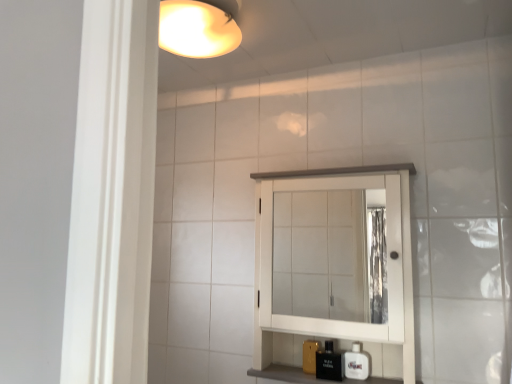
Measure the distance between point [386,177] and camera.

The distance of point [386,177] from camera is 4.38 feet.

Locate an element on the screen. black glossy bottle at lower center is located at coordinates (329, 363).

Does point (364, 376) lie behind point (321, 373)?

No, (364, 376) is in front of (321, 373).

Considering the relative sizes of white glossy soap dispenser at lower right and black glossy bottle at lower center in the image provided, is white glossy soap dispenser at lower right taller than black glossy bottle at lower center?

No.

Can you tell me how much white glossy soap dispenser at lower right and black glossy bottle at lower center differ in facing direction?

They differ by 0.0915 degrees in their facing directions.

From a real-world perspective, between white glossy soap dispenser at lower right and black glossy bottle at lower center, who is vertically lower?

In real-world perspective, black glossy bottle at lower center is lower.

Looking at this image, from their relative heights in the image, would you say black glossy bottle at lower center is taller or shorter than white glossy soap dispenser at lower right?

Considering their sizes, black glossy bottle at lower center has more height than white glossy soap dispenser at lower right.

Is point (318, 368) positioned behind point (368, 369)?

Yes, point (318, 368) is behind point (368, 369).

Is the surface of black glossy bottle at lower center in direct contact with white glossy soap dispenser at lower right?

Yes, black glossy bottle at lower center is in contact with white glossy soap dispenser at lower right.

Is white glossy soap dispenser at lower right facing away from white wood medicine cabinet at center?

Yes, white wood medicine cabinet at center is at the back of white glossy soap dispenser at lower right.

Considering the relative sizes of white glossy soap dispenser at lower right and white wood medicine cabinet at center in the image provided, is white glossy soap dispenser at lower right thinner than white wood medicine cabinet at center?

Correct, the width of white glossy soap dispenser at lower right is less than that of white wood medicine cabinet at center.

Which object is positioned more to the left, white glossy soap dispenser at lower right or white wood medicine cabinet at center?

From the viewer's perspective, white wood medicine cabinet at center appears more on the left side.

Is white glossy soap dispenser at lower right positioned in front of white wood medicine cabinet at center?

No, white glossy soap dispenser at lower right is behind white wood medicine cabinet at center.

Which is more to the right, black glossy bottle at lower center or white wood medicine cabinet at center?

white wood medicine cabinet at center.

From a real-world perspective, is black glossy bottle at lower center physically below white wood medicine cabinet at center?

Yes, from a real-world perspective, black glossy bottle at lower center is below white wood medicine cabinet at center.

From the image's perspective, is black glossy bottle at lower center below white wood medicine cabinet at center?

Indeed, from the image's perspective, black glossy bottle at lower center is shown beneath white wood medicine cabinet at center.

Considering the relative sizes of white wood medicine cabinet at center and black glossy bottle at lower center in the image provided, is white wood medicine cabinet at center bigger than black glossy bottle at lower center?

Yes, white wood medicine cabinet at center is bigger than black glossy bottle at lower center.

The height and width of the screenshot is (384, 512). What are the coordinates of `toiletry behind the white wood medicine cabinet at center` in the screenshot? It's located at (329, 363).

Is the position of white wood medicine cabinet at center more distant than that of black glossy bottle at lower center?

No, white wood medicine cabinet at center is in front of black glossy bottle at lower center.

Does point (264, 314) lie behind point (316, 353)?

Yes.

Between white wood medicine cabinet at center and white glossy soap dispenser at lower right, which one is positioned in front?

white wood medicine cabinet at center.

Is white wood medicine cabinet at center surrounding white glossy soap dispenser at lower right?

Absolutely, white glossy soap dispenser at lower right is inside white wood medicine cabinet at center.

Considering the sizes of white wood medicine cabinet at center and white glossy soap dispenser at lower right in the image, is white wood medicine cabinet at center bigger or smaller than white glossy soap dispenser at lower right?

white wood medicine cabinet at center is bigger than white glossy soap dispenser at lower right.

Where is `toiletry below the white glossy soap dispenser at lower right (from a real-world perspective)`? Image resolution: width=512 pixels, height=384 pixels. toiletry below the white glossy soap dispenser at lower right (from a real-world perspective) is located at coordinates (329, 363).

I want to click on soap dispenser above the black glossy bottle at lower center (from a real-world perspective), so click(357, 363).

Estimate the real-world distances between objects in this image. Which object is closer to white glossy soap dispenser at lower right, black glossy bottle at lower center or white wood medicine cabinet at center?

black glossy bottle at lower center is positioned closer to the anchor white glossy soap dispenser at lower right.

From the image, which object appears to be farther from black glossy bottle at lower center, white glossy soap dispenser at lower right or white wood medicine cabinet at center?

white wood medicine cabinet at center is further to black glossy bottle at lower center.

Which object lies further to the anchor point black glossy bottle at lower center, white wood medicine cabinet at center or white glossy soap dispenser at lower right?

Based on the image, white wood medicine cabinet at center appears to be further to black glossy bottle at lower center.

Based on their spatial positions, is white glossy soap dispenser at lower right or black glossy bottle at lower center closer to white wood medicine cabinet at center?

The object closer to white wood medicine cabinet at center is white glossy soap dispenser at lower right.

Which object lies nearer to the anchor point white glossy soap dispenser at lower right, white wood medicine cabinet at center or black glossy bottle at lower center?

Among the two, black glossy bottle at lower center is located nearer to white glossy soap dispenser at lower right.

Estimate the real-world distances between objects in this image. Which object is closer to white wood medicine cabinet at center, black glossy bottle at lower center or white glossy soap dispenser at lower right?

white glossy soap dispenser at lower right.

Where is `soap dispenser that lies between white wood medicine cabinet at center and black glossy bottle at lower center from top to bottom`? soap dispenser that lies between white wood medicine cabinet at center and black glossy bottle at lower center from top to bottom is located at coordinates (357, 363).